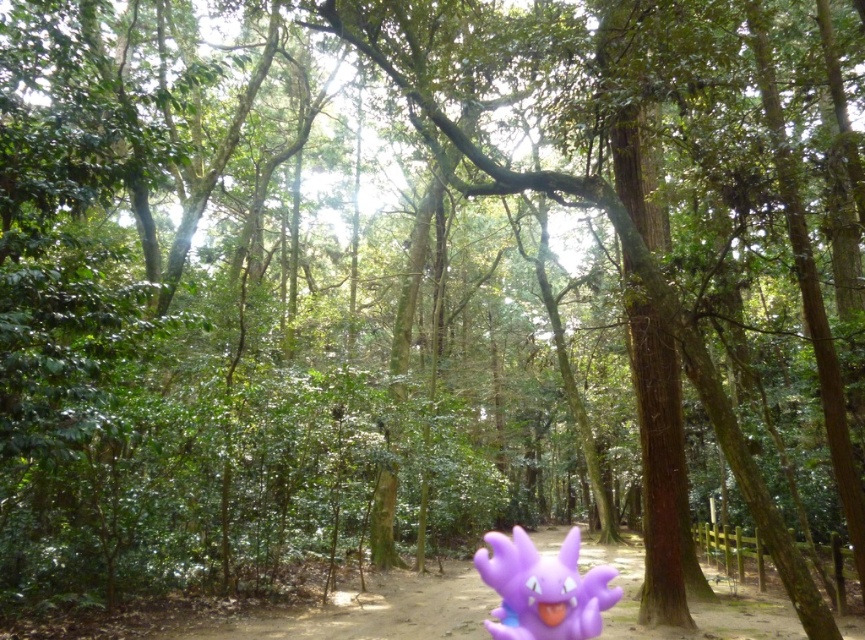
Question: Considering the relative positions of purple plastic toy at center and purple matte toy at lower center in the image provided, where is purple plastic toy at center located with respect to purple matte toy at lower center?

Choices:
 (A) below
 (B) above

Answer: (A)

Question: Among these objects, which one is farthest from the camera?

Choices:
 (A) purple plastic toy at center
 (B) purple matte toy at lower center

Answer: (A)

Question: Which point is farther from the camera taking this photo?

Choices:
 (A) (849, 627)
 (B) (571, 584)

Answer: (A)

Question: Is purple plastic toy at center above purple matte toy at lower center?

Choices:
 (A) yes
 (B) no

Answer: (B)

Question: Can you confirm if purple plastic toy at center is smaller than purple matte toy at lower center?

Choices:
 (A) no
 (B) yes

Answer: (A)

Question: Among these objects, which one is farthest from the camera?

Choices:
 (A) purple plastic toy at center
 (B) purple matte toy at lower center

Answer: (A)